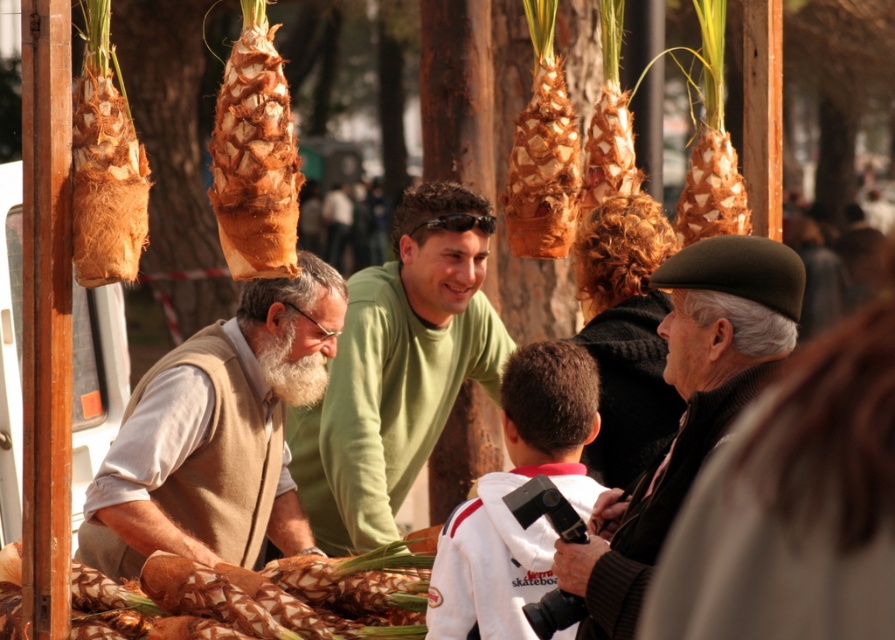
You are standing at the market and want to know how far the point at the center of the stall is from you. The point is labeled as point (789, 300). Can you determine the distance?

The point (789, 300) is 9.56 meters from the viewer.

You are a customer at the market and want to pick up the brown textured pineapple at center. However, there is a dark brown wool beret at center right in the way. Can you reach the pineapple without moving the beret?

The dark brown wool beret at center right is closer to the viewer than brown textured pineapple at center, so the beret is blocking the path to the pineapple. You would need to move the beret to reach the pineapple.

In the scene shown: You are a vendor at the market and want to place both the dark brown wool beret at center right and the brown papery onion at upper center on a shelf. Which item should you place first if you want to ensure both fit without overlapping?

The dark brown wool beret at center right has a larger size compared to brown papery onion at upper center, so you should place the dark brown wool beret at center right first to ensure both fit without overlapping.